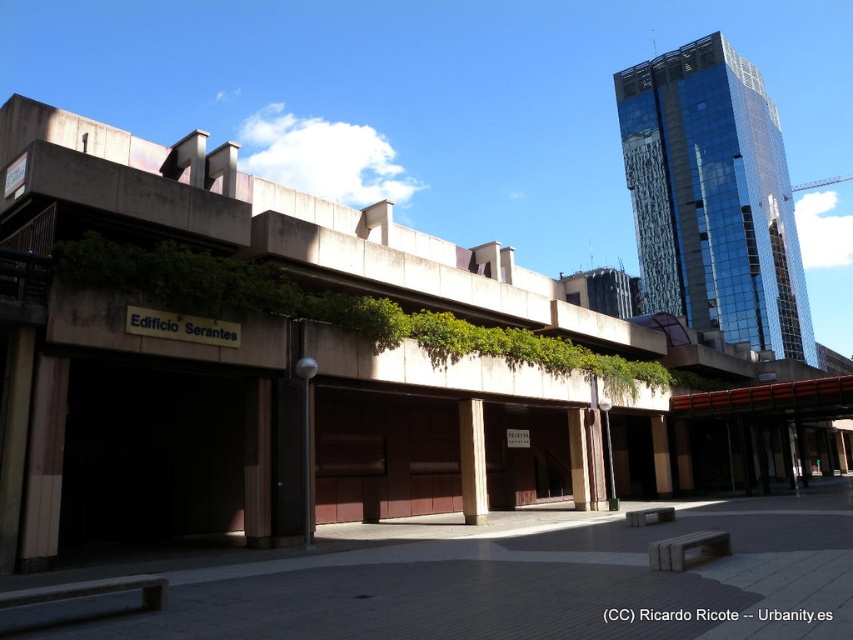
Is glassy reflective skyscraper at upper right smaller than brown wood pillar at center?

Incorrect, glassy reflective skyscraper at upper right is not smaller in size than brown wood pillar at center.

Which is below, glassy reflective skyscraper at upper right or brown wood pillar at center?

brown wood pillar at center is below.

Which is behind, point (740, 220) or point (572, 419)?

Point (740, 220)

This screenshot has width=853, height=640. I want to click on glassy reflective skyscraper at upper right, so click(x=712, y=196).

Can you confirm if smooth concrete pillar at center is smaller than brown wood pillar at center?

No, smooth concrete pillar at center is not smaller than brown wood pillar at center.

Does smooth concrete pillar at center have a greater width compared to brown wood pillar at center?

Correct, the width of smooth concrete pillar at center exceeds that of brown wood pillar at center.

Measure the distance between smooth concrete pillar at center and camera.

The distance of smooth concrete pillar at center from camera is 18.65 meters.

At what (x,y) coordinates should I click in order to perform the action: click on smooth concrete pillar at center. Please return your answer as a coordinate pair (x, y). The width and height of the screenshot is (853, 640). Looking at the image, I should click on (473, 461).

Can you confirm if glassy reflective skyscraper at upper right is taller than smooth concrete pillar at center?

Indeed, glassy reflective skyscraper at upper right has a greater height compared to smooth concrete pillar at center.

Looking at this image, who is positioned more to the right, glassy reflective skyscraper at upper right or smooth concrete pillar at center?

glassy reflective skyscraper at upper right is more to the right.

Who is more distant from viewer, (732, 145) or (486, 490)?

Point (732, 145)

This screenshot has height=640, width=853. Identify the location of glassy reflective skyscraper at upper right. (712, 196).